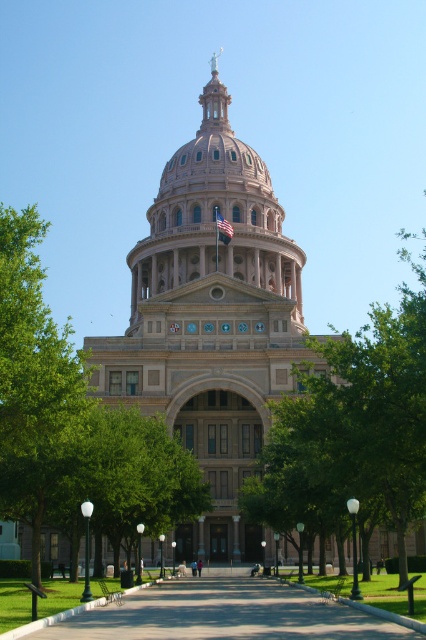
You are standing in front of the grand neoclassical building. You notice a green leafy tree at center and a beige stone dome at center. Which object is closer to you?

The green leafy tree at center is positioned under the beige stone dome at center, so the tree is closer to you than the dome.

You are standing in front of the grand neoclassical building and want to take a photo of the green leafy tree at center. Where should you position yourself to ensure the tree is centered in your photo?

The green leafy tree at center is located at point coordinates approximately 0.675 on the x axis and 0.829 on the y axis. To center it in your photo, position yourself so the tree aligns with the center point of your camera frame at those coordinates.